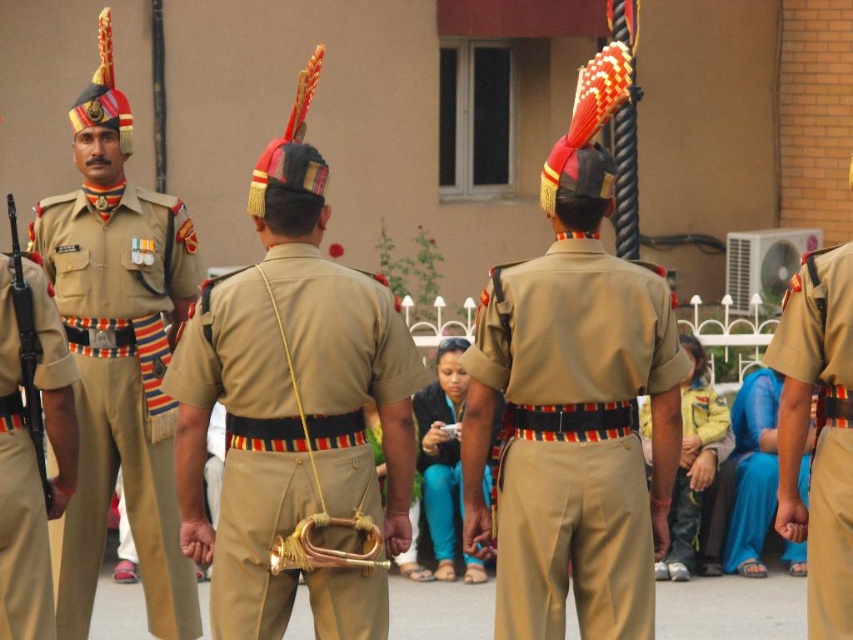
Question: Which point is farther to the camera?

Choices:
 (A) khaki cotton pants at center
 (B) matte khaki uniform at center
 (C) matte gold trumpet at center

Answer: (B)

Question: Estimate the real-world distances between objects in this image. Which object is closer to the blue fabric dress at lower right?

Choices:
 (A) matte gold trumpet at center
 (B) khaki cotton pants at lower right
 (C) khaki cotton pants at center
 (D) matte khaki uniform at center

Answer: (B)

Question: Which point is closer to the camera taking this photo?

Choices:
 (A) (724, 566)
 (B) (160, 225)

Answer: (B)

Question: Does blue fabric dress at lower right lie in front of matte khaki pants at center?

Choices:
 (A) yes
 (B) no

Answer: (B)

Question: Is matte gold trumpet at center further to the viewer compared to blue fabric dress at lower right?

Choices:
 (A) no
 (B) yes

Answer: (A)

Question: Is matte khaki uniform at left wider than gold brass trumpet at center?

Choices:
 (A) yes
 (B) no

Answer: (B)